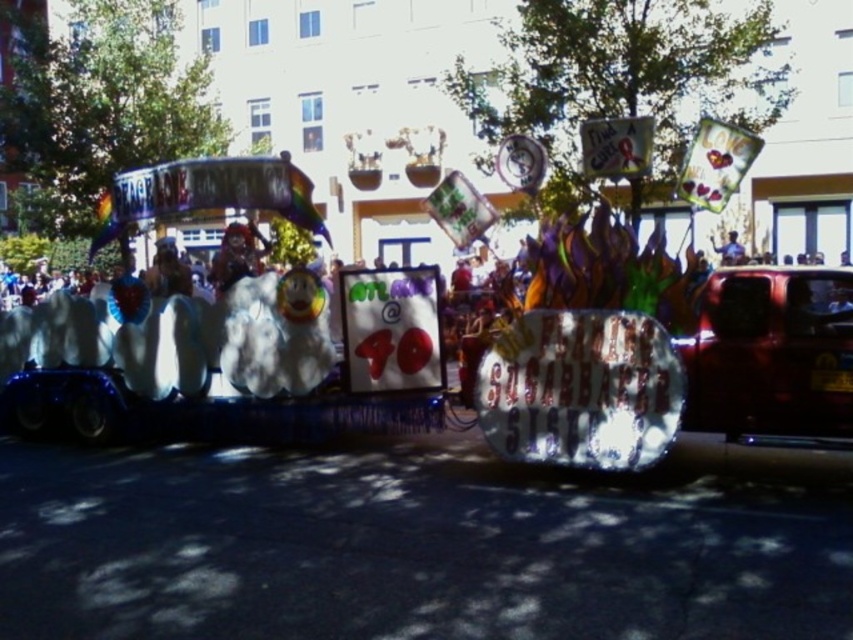
Is point (813, 316) less distant than point (722, 264)?

Yes, point (813, 316) is in front of point (722, 264).

From the picture: Who is more forward, (723, 422) or (732, 256)?

Point (723, 422) is in front.

You are a GUI agent. You are given a task and a screenshot of the screen. Output one action in this format:
    pyautogui.click(x=<x>, y=<y>)
    Task: Click on the shiny red car at right
    This screenshot has width=853, height=640.
    Given the screenshot: What is the action you would take?
    pyautogui.click(x=770, y=353)